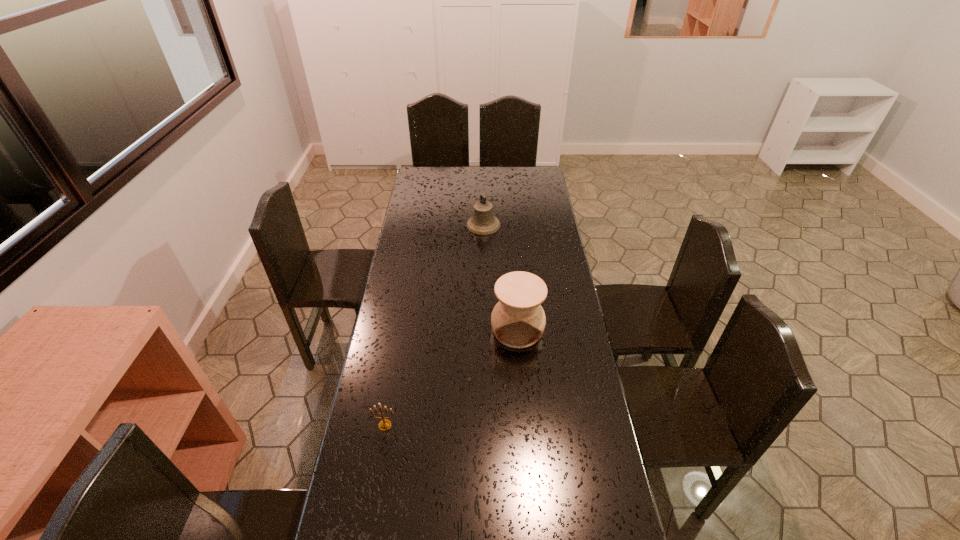
What are the coordinates of `object situated at the right edge` in the screenshot? It's located at [x=518, y=320].

In order to click on blank area at the far edge in this screenshot , I will do `click(449, 183)`.

Where is `vacant region at the left edge of the desktop`? vacant region at the left edge of the desktop is located at coordinates (404, 284).

Find the location of `vacant space at the right edge of the desktop`. vacant space at the right edge of the desktop is located at coordinates (559, 274).

The width and height of the screenshot is (960, 540). In the image, there is a desktop. In order to click on vacant space at the far right corner in this screenshot , I will do `click(539, 168)`.

In order to click on vacant point located between the leftmost object and the farthest object in this screenshot , I will do `click(434, 325)`.

Where is `empty space between the nearest object and the tallest object`? The image size is (960, 540). empty space between the nearest object and the tallest object is located at coordinates (451, 377).

Find the location of `free spot between the tallest object and the leftmost object`. free spot between the tallest object and the leftmost object is located at coordinates (451, 377).

This screenshot has height=540, width=960. What are the coordinates of `vacant space in between the nearest object and the second shortest object` in the screenshot? It's located at (434, 325).

Identify the location of object that is the nearest to the bell. (518, 320).